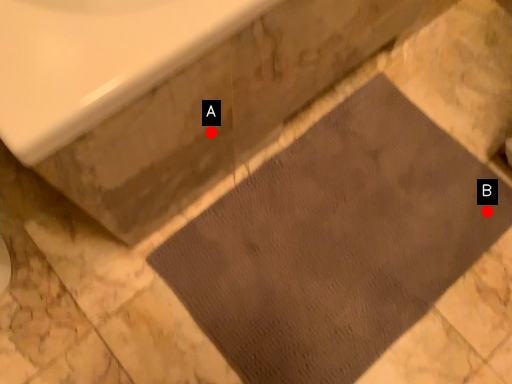
Question: Two points are circled on the image, labeled by A and B beside each circle. Which point is further to the camera?

Choices:
 (A) A is further
 (B) B is further

Answer: (B)